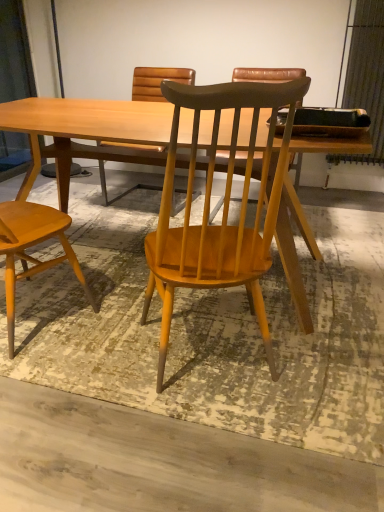
Question: Can you confirm if light brown wood chair at left, positioned as the 2th chair in right-to-left order, is bigger than light wood table at center?

Choices:
 (A) no
 (B) yes

Answer: (A)

Question: Is light brown wood chair at left, positioned as the 2th chair in right-to-left order, in front of light wood table at center?

Choices:
 (A) no
 (B) yes

Answer: (B)

Question: Is light brown wood chair at left, positioned as the 2th chair in right-to-left order, in contact with light wood table at center?

Choices:
 (A) yes
 (B) no

Answer: (B)

Question: From the image's perspective, is light brown wood chair at left, the 1th chair when ordered from left to right, over light wood table at center?

Choices:
 (A) yes
 (B) no

Answer: (B)

Question: Is light brown wood chair at left, the 1th chair when ordered from left to right, oriented away from light wood table at center?

Choices:
 (A) yes
 (B) no

Answer: (B)

Question: Is light brown wood chair at left, positioned as the 2th chair in right-to-left order, facing towards light wood table at center?

Choices:
 (A) yes
 (B) no

Answer: (A)

Question: Can you confirm if light wood table at center is positioned to the right of wooden chair at center, arranged as the second chair when viewed from the left?

Choices:
 (A) yes
 (B) no

Answer: (B)

Question: Is light wood table at center outside wooden chair at center, arranged as the second chair when viewed from the left?

Choices:
 (A) yes
 (B) no

Answer: (A)

Question: Is light wood table at center closer to camera compared to wooden chair at center, arranged as the second chair when viewed from the left?

Choices:
 (A) no
 (B) yes

Answer: (A)

Question: Considering the relative sizes of light wood table at center and wooden chair at center, arranged as the second chair when viewed from the left, in the image provided, is light wood table at center bigger than wooden chair at center, arranged as the second chair when viewed from the left,?

Choices:
 (A) yes
 (B) no

Answer: (A)

Question: From a real-world perspective, is light wood table at center on wooden chair at center, the first chair in the right-to-left sequence?

Choices:
 (A) yes
 (B) no

Answer: (B)

Question: From the image's perspective, is light wood table at center located beneath wooden chair at center, arranged as the second chair when viewed from the left?

Choices:
 (A) yes
 (B) no

Answer: (B)

Question: From the image's perspective, is wooden chair at center, the first chair in the right-to-left sequence, below light wood table at center?

Choices:
 (A) no
 (B) yes

Answer: (B)